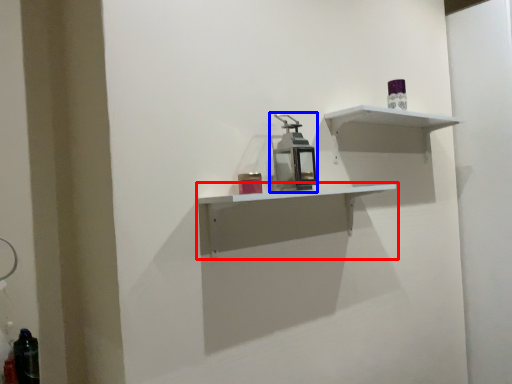
Question: Which object is further to the camera taking this photo, shelf (highlighted by a red box) or medicine cabinet (highlighted by a blue box)?

Choices:
 (A) shelf
 (B) medicine cabinet

Answer: (B)